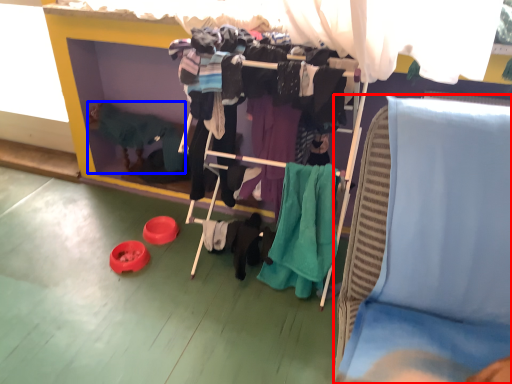
Question: Which of the following is the closest to the observer, furniture (highlighted by a red box) or person (highlighted by a blue box)?

Choices:
 (A) furniture
 (B) person

Answer: (A)